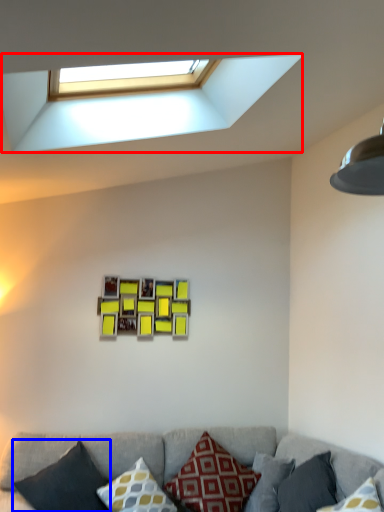
Question: Which object appears farthest to the camera in this image, window (highlighted by a red box) or pillow (highlighted by a blue box)?

Choices:
 (A) window
 (B) pillow

Answer: (B)